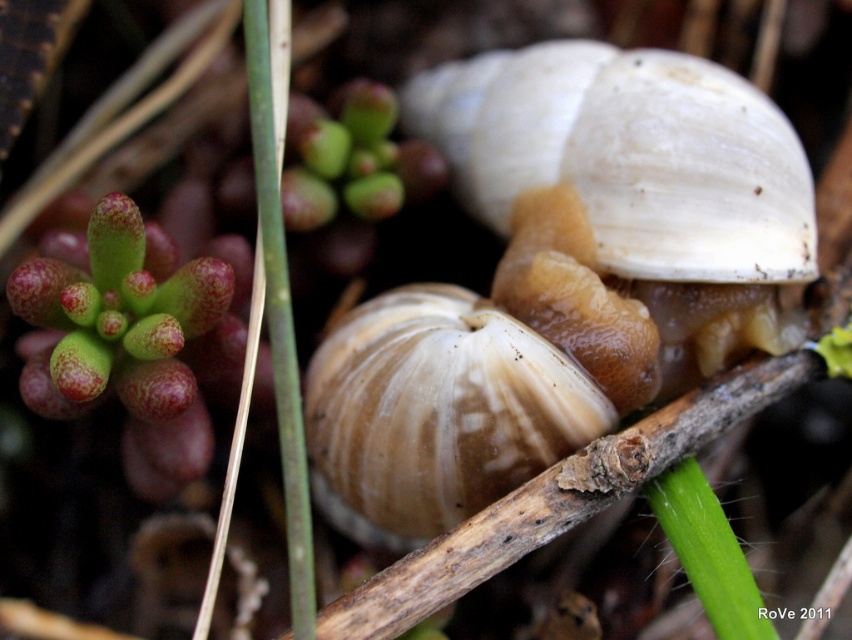
Question: Which point is farther to the camera?

Choices:
 (A) white matte snail at center
 (B) matte brown shell at center

Answer: (A)

Question: Where is white matte snail at center located in relation to matte brown shell at center in the image?

Choices:
 (A) above
 (B) below

Answer: (A)

Question: Which point is farther to the camera?

Choices:
 (A) (795, 147)
 (B) (392, 301)

Answer: (B)

Question: Is white matte snail at center below matte brown shell at center?

Choices:
 (A) no
 (B) yes

Answer: (A)

Question: Does white matte snail at center appear on the right side of matte brown shell at center?

Choices:
 (A) yes
 (B) no

Answer: (A)